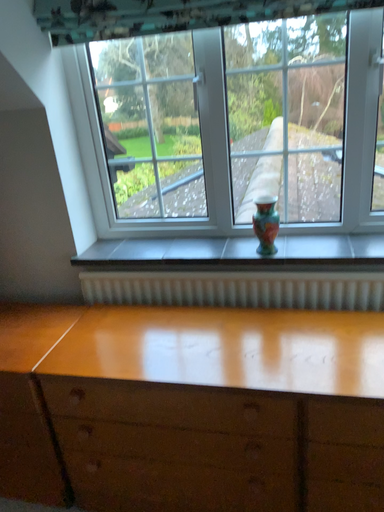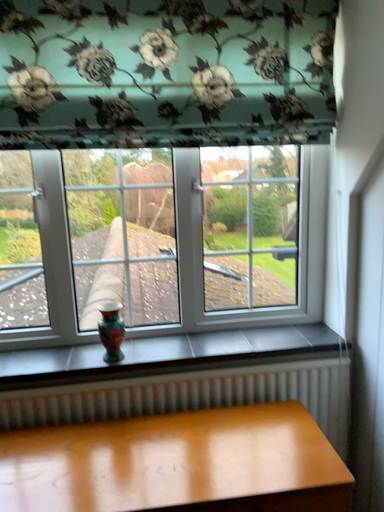
Question: How did the camera likely rotate when shooting the video?

Choices:
 (A) rotated left
 (B) rotated right

Answer: (B)